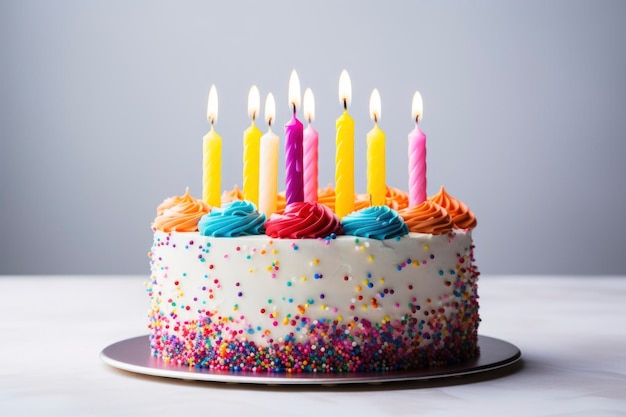
Identify the location of candle flames. The image size is (626, 417). (216, 102), (250, 106), (268, 112), (294, 92), (312, 114), (342, 88), (377, 113), (419, 120).